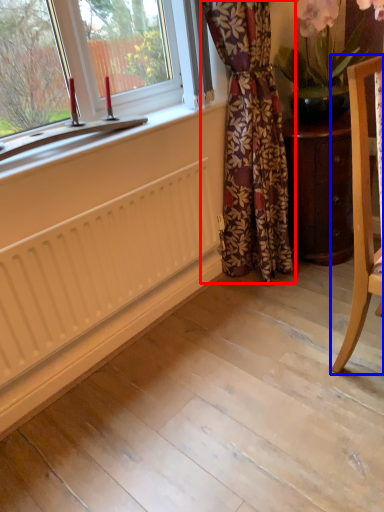
Question: Which object is further to the camera taking this photo, curtain (highlighted by a red box) or chair (highlighted by a blue box)?

Choices:
 (A) curtain
 (B) chair

Answer: (A)